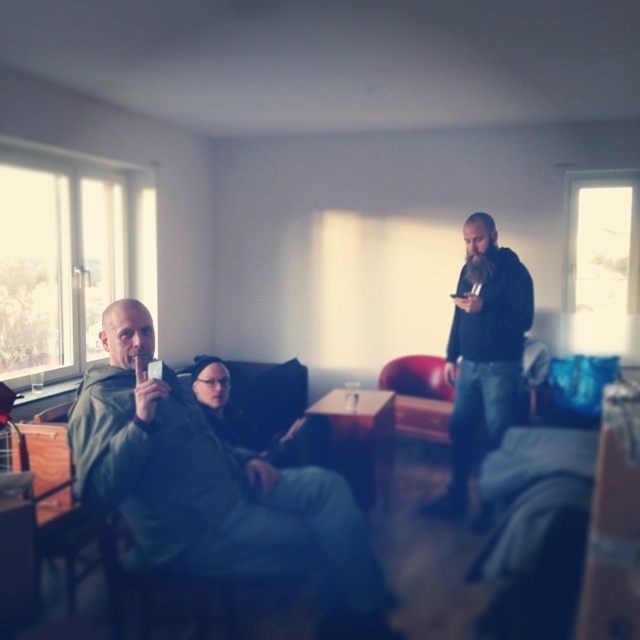
Question: Can you confirm if green matte jacket at left is bigger than black matte jacket at right?

Choices:
 (A) no
 (B) yes

Answer: (B)

Question: Is green matte jacket at left in front of black matte jacket at right?

Choices:
 (A) yes
 (B) no

Answer: (A)

Question: Does green matte jacket at left have a greater width compared to black matte jacket at right?

Choices:
 (A) yes
 (B) no

Answer: (A)

Question: Among these objects, which one is nearest to the camera?

Choices:
 (A) black matte jacket at right
 (B) green matte jacket at left

Answer: (B)